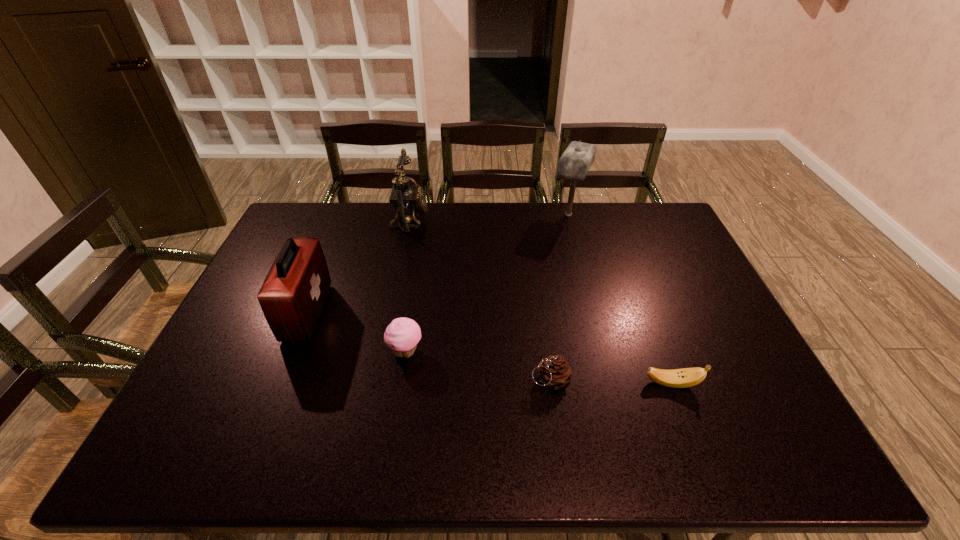
Where is `vacant region that satisfies the following two spatial constraints: 1. on the side of the cupcake with the cross symbol; 2. on the right side of the first aid kit`? This screenshot has height=540, width=960. vacant region that satisfies the following two spatial constraints: 1. on the side of the cupcake with the cross symbol; 2. on the right side of the first aid kit is located at coordinates (292, 352).

You are a GUI agent. You are given a task and a screenshot of the screen. Output one action in this format:
    pyautogui.click(x=<x>, y=<y>)
    Task: Click on the vacant space that satisfies the following two spatial constraints: 1. on the side of the cupcake with the cross symbol; 2. on the right side of the first aid kit
    This screenshot has width=960, height=540.
    Given the screenshot: What is the action you would take?
    (x=292, y=352)

Find the location of a particular element. The width and height of the screenshot is (960, 540). free region that satisfies the following two spatial constraints: 1. on the side of the rightmost object with the cross symbol; 2. on the right side of the first aid kit is located at coordinates (279, 383).

Find the location of a particular element. vacant area that satisfies the following two spatial constraints: 1. on the rotary dial of the telephone; 2. on the back side of the cupcake is located at coordinates (383, 352).